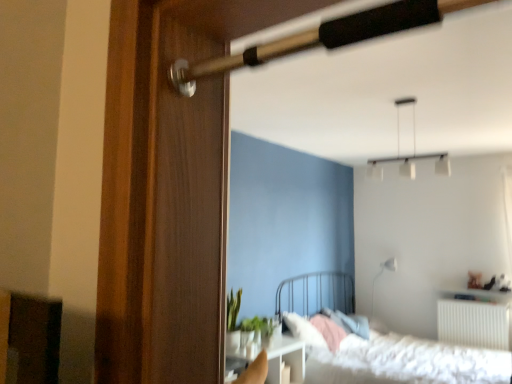
Question: From a real-world perspective, is green matte plant at center under white glossy lamp at upper right, marked as the second lamp in a front-to-back arrangement?

Choices:
 (A) yes
 (B) no

Answer: (A)

Question: Does green matte plant at center lie behind white glossy lamp at upper right, marked as the second lamp in a front-to-back arrangement?

Choices:
 (A) no
 (B) yes

Answer: (A)

Question: Is green matte plant at center at the right side of white glossy lamp at upper right, the second lamp when ordered from left to right?

Choices:
 (A) no
 (B) yes

Answer: (A)

Question: Does green matte plant at center have a larger size compared to white glossy lamp at upper right, the second lamp when ordered from left to right?

Choices:
 (A) yes
 (B) no

Answer: (B)

Question: Is green matte plant at center facing towards white glossy lamp at upper right, which ranks as the 2th lamp in top-to-bottom order?

Choices:
 (A) yes
 (B) no

Answer: (B)

Question: Is point (284, 355) closer or farther from the camera than point (396, 117)?

Choices:
 (A) closer
 (B) farther

Answer: (B)

Question: Is white glossy table at lower center taller or shorter than white matte pendant light at upper center, the 1th lamp from the top?

Choices:
 (A) short
 (B) tall

Answer: (A)

Question: Looking at the image, does white glossy table at lower center seem bigger or smaller compared to white matte pendant light at upper center, which is counted as the 2th lamp, starting from the right?

Choices:
 (A) small
 (B) big

Answer: (B)

Question: Is white glossy table at lower center spatially inside white matte pendant light at upper center, which is the second lamp in bottom-to-top order, or outside of it?

Choices:
 (A) inside
 (B) outside

Answer: (B)

Question: From the image's perspective, is white glossy table at lower center above or below wooden screen door at left?

Choices:
 (A) below
 (B) above

Answer: (A)

Question: Considering the positions of white glossy table at lower center and wooden screen door at left in the image, is white glossy table at lower center taller or shorter than wooden screen door at left?

Choices:
 (A) short
 (B) tall

Answer: (A)

Question: Relative to wooden screen door at left, is white glossy table at lower center in front or behind?

Choices:
 (A) front
 (B) behind

Answer: (B)

Question: Is white glossy table at lower center inside or outside of wooden screen door at left?

Choices:
 (A) outside
 (B) inside

Answer: (A)

Question: From the image's perspective, is green matte plant at center above or below white glossy table at lower center?

Choices:
 (A) below
 (B) above

Answer: (B)

Question: Is green matte plant at center inside or outside of white glossy table at lower center?

Choices:
 (A) outside
 (B) inside

Answer: (A)